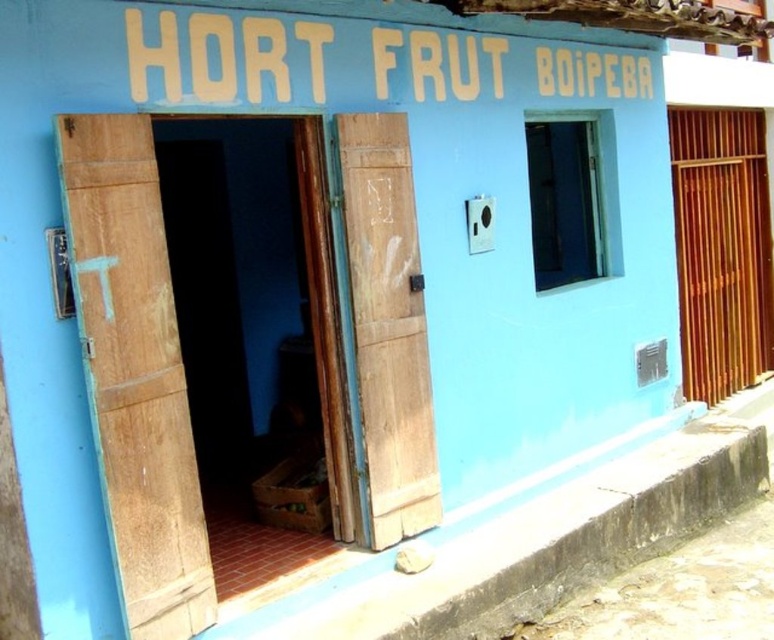
Is wooden at left below wooden door at center?

Yes, wooden at left is below wooden door at center.

Is wooden at left above wooden door at center?

Actually, wooden at left is below wooden door at center.

Image resolution: width=774 pixels, height=640 pixels. I want to click on wooden at left, so click(135, 372).